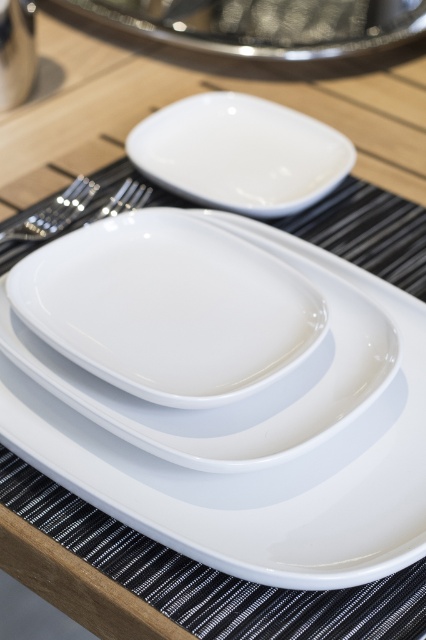
Which is behind, point (405, 364) or point (298, 205)?

The point (298, 205) is more distant.

At what (x,y) coordinates should I click in order to perform the action: click on glossy ceramic plate at center. Please return your answer as a coordinate pair (x, y). Image resolution: width=426 pixels, height=640 pixels. Looking at the image, I should click on (252, 442).

Is point (232, 307) positioned after point (121, 20)?

No, (232, 307) is closer to viewer.

Between white glossy platter at center and white glossy platter at upper center, which one is positioned lower?

white glossy platter at center

Is point (242, 324) farther from camera compared to point (308, 60)?

No, it is not.

Where is `white glossy platter at center`? This screenshot has height=640, width=426. white glossy platter at center is located at coordinates (167, 307).

Which is below, white glossy saucer at center or white glossy platter at upper center?

white glossy saucer at center is below.

Identify the location of white glossy saucer at center. (x=239, y=154).

What do you see at coordinates (239, 154) in the screenshot? I see `white glossy saucer at center` at bounding box center [239, 154].

Identify the location of white glossy saucer at center. This screenshot has width=426, height=640. (239, 154).